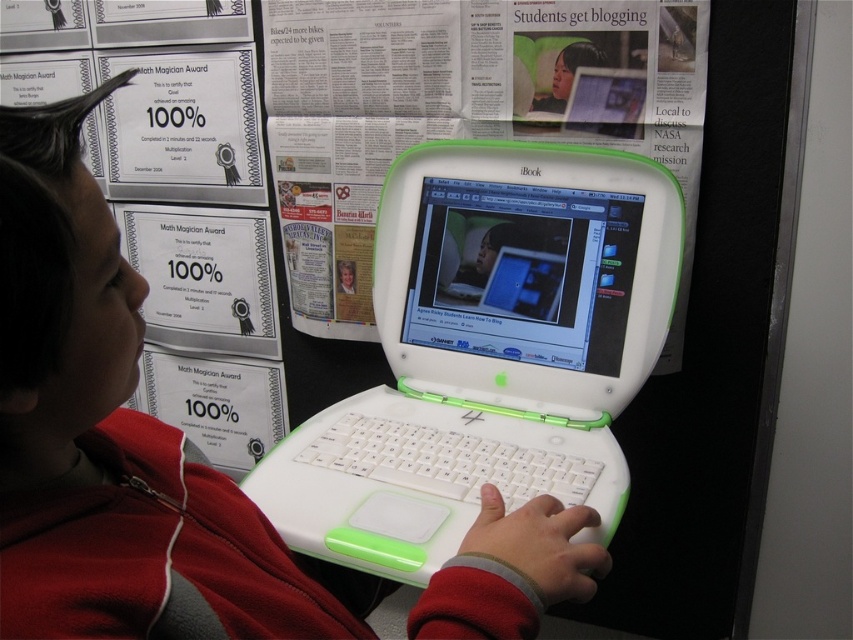
Which is behind, point (570, 452) or point (70, 460)?

Positioned behind is point (570, 452).

Where is `white plastic laptop at center`? Image resolution: width=853 pixels, height=640 pixels. white plastic laptop at center is located at coordinates (486, 352).

I want to click on white plastic laptop at center, so click(x=486, y=352).

The height and width of the screenshot is (640, 853). Identify the location of white plastic laptop at center. (486, 352).

The width and height of the screenshot is (853, 640). What do you see at coordinates (486, 352) in the screenshot? I see `white plastic laptop at center` at bounding box center [486, 352].

Is white plastic laptop at center further to camera compared to white plastic laptop at upper center?

No, white plastic laptop at center is in front of white plastic laptop at upper center.

The image size is (853, 640). What do you see at coordinates (486, 352) in the screenshot? I see `white plastic laptop at center` at bounding box center [486, 352].

What are the coordinates of `white plastic laptop at center` in the screenshot? It's located at (486, 352).

Between matte white jacket at center and white plastic laptop at upper center, which one is positioned lower?

Positioned lower is matte white jacket at center.

Is matte white jacket at center positioned in front of white plastic laptop at upper center?

Yes, matte white jacket at center is closer to the viewer.

What do you see at coordinates (117, 442) in the screenshot? I see `matte white jacket at center` at bounding box center [117, 442].

Find the location of a particular element. The image size is (853, 640). matte white jacket at center is located at coordinates (117, 442).